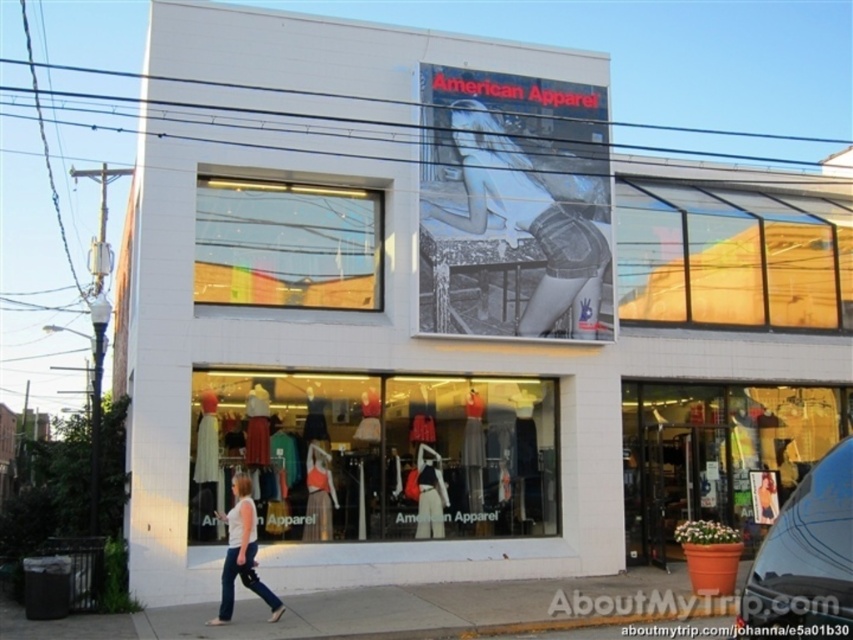
Question: Can you confirm if transparent glass at center is thinner than denim shorts at upper center?

Choices:
 (A) no
 (B) yes

Answer: (B)

Question: Based on their relative distances, which object is farther from the white cotton shirt at lower center?

Choices:
 (A) matte glass display at center
 (B) denim shorts at upper center

Answer: (B)

Question: Among these points, which one is nearest to the camera?

Choices:
 (A) click(413, 444)
 (B) click(474, 608)
 (C) click(312, 516)
 (D) click(331, 300)

Answer: (B)

Question: Which point is farther to the camera?

Choices:
 (A) transparent glass at center
 (B) matte black dress at center

Answer: (B)

Question: Is matte orange dress at center further to camera compared to matte black dress at center?

Choices:
 (A) yes
 (B) no

Answer: (B)

Question: Can you confirm if smooth concrete sidewalk at lower center is positioned above white cotton shirt at lower center?

Choices:
 (A) yes
 (B) no

Answer: (B)